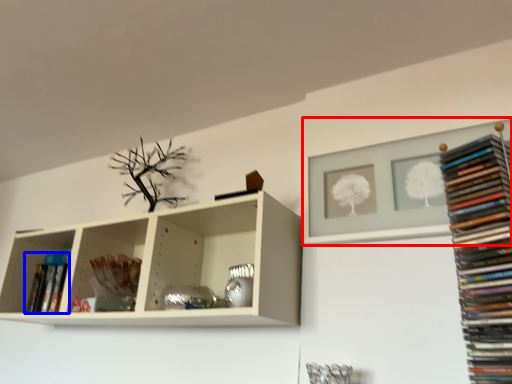
Question: Which object is further to the camera taking this photo, shelf (highlighted by a red box) or book (highlighted by a blue box)?

Choices:
 (A) shelf
 (B) book

Answer: (B)